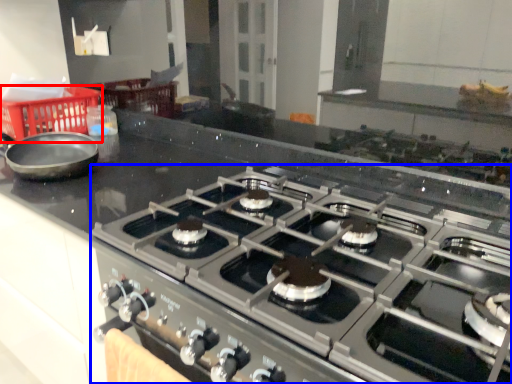
Question: Which object is further to the camera taking this photo, basket (highlighted by a red box) or gas stove (highlighted by a blue box)?

Choices:
 (A) basket
 (B) gas stove

Answer: (A)